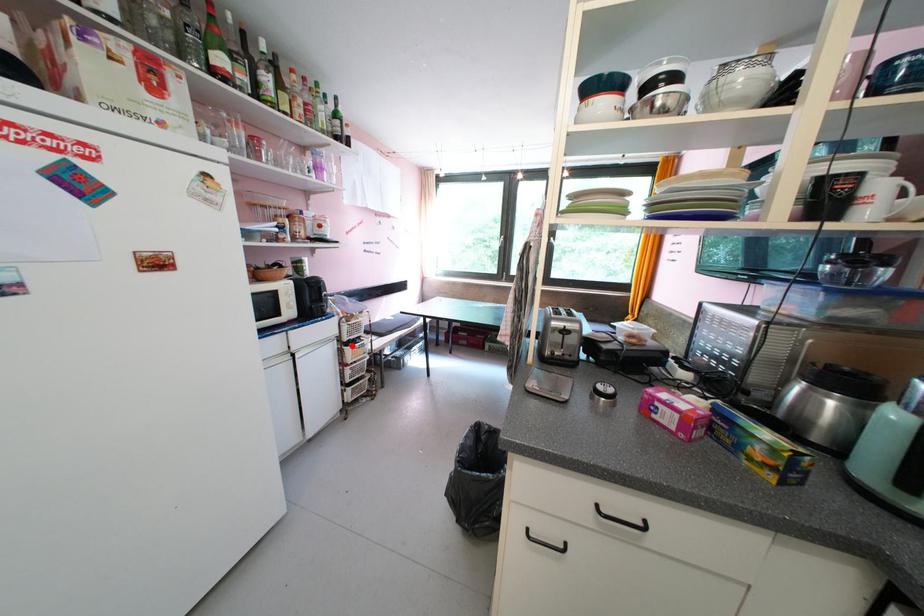
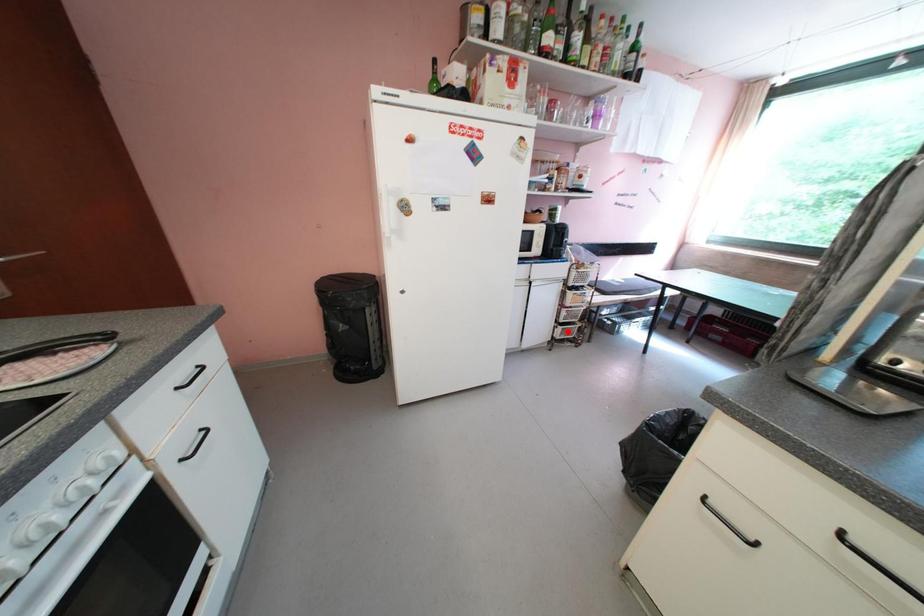
I am providing you with two images of the same scene from different viewpoints. A red point is marked on the first image and another point is marked on the second image. Is the marked point in image1 the same physical position as the marked point in image2?

No